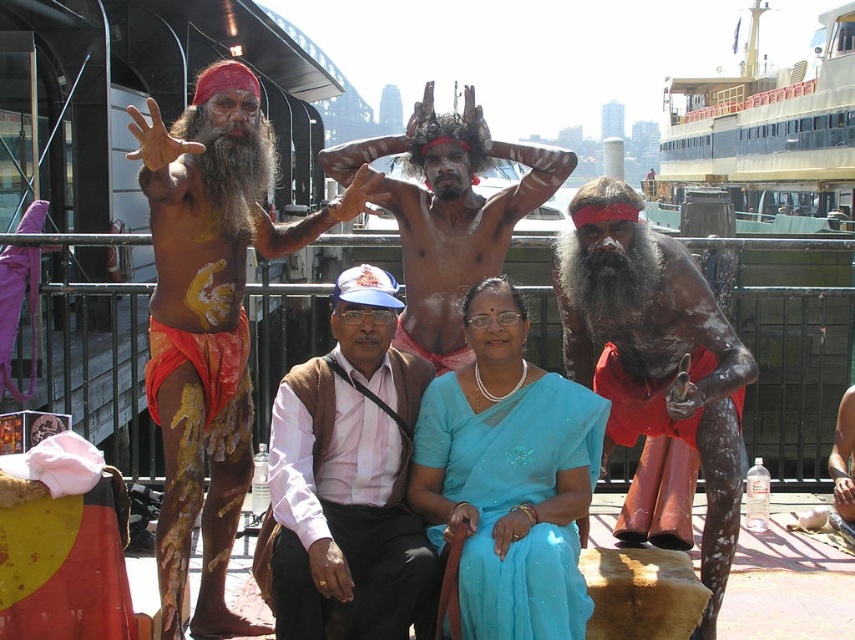
Between light pink fabric at center and blue silk saree at center, which one appears on the right side from the viewer's perspective?

From the viewer's perspective, blue silk saree at center appears more on the right side.

Can you confirm if light pink fabric at center is positioned to the right of blue silk saree at center?

No, light pink fabric at center is not to the right of blue silk saree at center.

What do you see at coordinates (346, 480) in the screenshot? The image size is (855, 640). I see `light pink fabric at center` at bounding box center [346, 480].

Find the location of a particular element. The width and height of the screenshot is (855, 640). light pink fabric at center is located at coordinates (346, 480).

Can you confirm if matte black body paint at center is taller than yellow painted steel ferry at upper right?

In fact, matte black body paint at center may be shorter than yellow painted steel ferry at upper right.

Describe the element at coordinates (656, 355) in the screenshot. I see `matte black body paint at center` at that location.

Where is `matte black body paint at center`? matte black body paint at center is located at coordinates (656, 355).

Is blue silk saree at center to the right of matte skin man at center from the viewer's perspective?

Indeed, blue silk saree at center is positioned on the right side of matte skin man at center.

This screenshot has height=640, width=855. I want to click on blue silk saree at center, so click(508, 476).

Locate an element on the screen. Image resolution: width=855 pixels, height=640 pixels. blue silk saree at center is located at coordinates (508, 476).